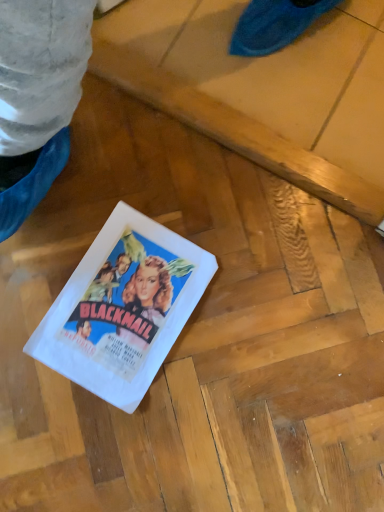
Where is `free point above white matte book at center (from a real-world perspective)`? The height and width of the screenshot is (512, 384). free point above white matte book at center (from a real-world perspective) is located at coordinates (117, 301).